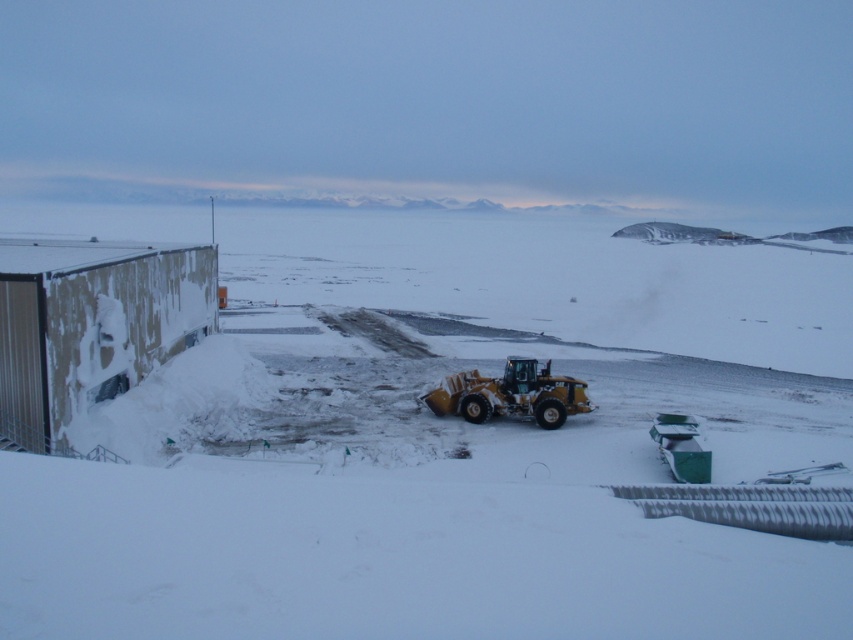
You are standing at the edge of the snowy landscape and want to reach the yellow construction vehicle parked on the cleared patch. Which direction should you walk to avoid stepping on the white powdery snow at center?

The white powdery snow at center is located at point [444,444], so you should walk towards the cleared patch where the yellow construction vehicle is parked, avoiding the area around those coordinates.

You are a snowplow operator who needs to clear a path. You see the white powdery snow at center and the yellow rubber plow at center. Which object is located higher in the image?

The white powdery snow at center is above the yellow rubber plow at center, so the white powdery snow at center is higher in the image.

You are a snowplow operator trying to clear a path through the white powdery snow at center and the yellow rubber plow at center. Based on their heights, which one do you think will be harder to clear?

The white powdery snow at center has a greater height compared to the yellow rubber plow at center, so it will be harder to clear the white powdery snow at center.